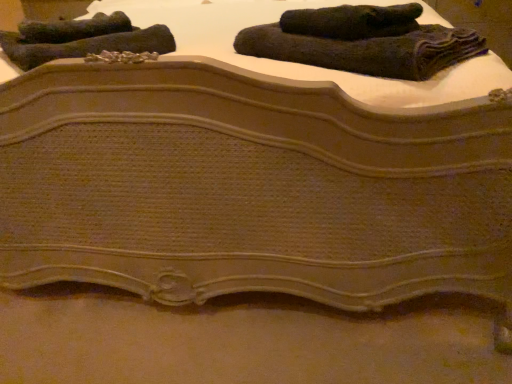
Describe the element at coordinates (352, 21) in the screenshot. This screenshot has height=384, width=512. I see `dark woolen towel at upper right, which appears as the third towel when viewed from the left` at that location.

The height and width of the screenshot is (384, 512). What do you see at coordinates (74, 28) in the screenshot?
I see `dark gray textured towel at upper left, the first towel viewed from the left` at bounding box center [74, 28].

You are a GUI agent. You are given a task and a screenshot of the screen. Output one action in this format:
    pyautogui.click(x=<x>, y=<y>)
    Task: Click on the dark woolen towel at upper center, which appears as the 1th towel when viewed from the right
    The image size is (512, 384).
    Given the screenshot: What is the action you would take?
    pyautogui.click(x=368, y=50)

What do you see at coordinates (86, 46) in the screenshot?
I see `dark green textured towel at upper left, which ranks as the third towel in right-to-left order` at bounding box center [86, 46].

Identify the location of dark woolen towel at upper right, which appears as the third towel when viewed from the left. Image resolution: width=512 pixels, height=384 pixels. (352, 21).

Relative to dark woolen towel at upper right, which appears as the third towel when viewed from the left, is dark gray textured towel at upper left, the first towel viewed from the left, in front or behind?

Visually, dark gray textured towel at upper left, the first towel viewed from the left, is located behind dark woolen towel at upper right, which appears as the third towel when viewed from the left.

Considering the sizes of objects dark gray textured towel at upper left, the first towel viewed from the left, and dark woolen towel at upper right, which is the second towel in right-to-left order, in the image provided, who is wider, dark gray textured towel at upper left, the first towel viewed from the left, or dark woolen towel at upper right, which is the second towel in right-to-left order,?

dark gray textured towel at upper left, the first towel viewed from the left, is wider.

Between point (103, 25) and point (293, 24), which one is positioned behind?

The point (103, 25) is more distant.

From the image's perspective, count 2nd towels downward from the dark gray textured towel at upper left, the first towel viewed from the left, and point to it. Please provide its 2D coordinates.

[(352, 21)]

From the image's perspective, would you say dark woolen towel at upper center, which appears as the 1th towel when viewed from the right, is shown under dark green textured towel at upper left, the second towel viewed from the left?

Yes, from the image's perspective, dark woolen towel at upper center, which appears as the 1th towel when viewed from the right, is below dark green textured towel at upper left, the second towel viewed from the left.

Does dark woolen towel at upper center, which is the 4th towel in left-to-right order, have a smaller size compared to dark green textured towel at upper left, which ranks as the third towel in right-to-left order?

Incorrect, dark woolen towel at upper center, which is the 4th towel in left-to-right order, is not smaller in size than dark green textured towel at upper left, which ranks as the third towel in right-to-left order.

Is dark woolen towel at upper center, which is the 4th towel in left-to-right order, taller than dark green textured towel at upper left, which ranks as the third towel in right-to-left order?

Correct, dark woolen towel at upper center, which is the 4th towel in left-to-right order, is much taller as dark green textured towel at upper left, which ranks as the third towel in right-to-left order.

Between dark woolen towel at upper center, which is the 4th towel in left-to-right order, and dark green textured towel at upper left, which ranks as the third towel in right-to-left order, which one is positioned in front?

dark woolen towel at upper center, which is the 4th towel in left-to-right order, is more forward.

Which of these two, dark gray textured towel at upper left, which is counted as the fourth towel, starting from the right, or dark green textured towel at upper left, which ranks as the third towel in right-to-left order, stands taller?

dark gray textured towel at upper left, which is counted as the fourth towel, starting from the right, is taller.

Which is farther, (115,20) or (22,70)?

Positioned behind is point (115,20).

From the image's perspective, does dark gray textured towel at upper left, the first towel viewed from the left, appear lower than dark green textured towel at upper left, the second towel viewed from the left?

No, from the image's perspective, dark gray textured towel at upper left, the first towel viewed from the left, is not beneath dark green textured towel at upper left, the second towel viewed from the left.

Does dark gray textured towel at upper left, which is counted as the fourth towel, starting from the right, appear on the left side of dark green textured towel at upper left, which ranks as the third towel in right-to-left order?

Yes, dark gray textured towel at upper left, which is counted as the fourth towel, starting from the right, is to the left of dark green textured towel at upper left, which ranks as the third towel in right-to-left order.

Looking at this image, considering the positions of objects dark woolen towel at upper center, which appears as the 1th towel when viewed from the right, and dark woolen towel at upper right, which appears as the third towel when viewed from the left, in the image provided, who is more to the left, dark woolen towel at upper center, which appears as the 1th towel when viewed from the right, or dark woolen towel at upper right, which appears as the third towel when viewed from the left,?

dark woolen towel at upper right, which appears as the third towel when viewed from the left.

Could you tell me if dark woolen towel at upper center, which is the 4th towel in left-to-right order, is turned towards dark woolen towel at upper right, which is the second towel in right-to-left order?

No, dark woolen towel at upper center, which is the 4th towel in left-to-right order, is not facing towards dark woolen towel at upper right, which is the second towel in right-to-left order.

Based on the photo, between dark woolen towel at upper center, which is the 4th towel in left-to-right order, and dark woolen towel at upper right, which is the second towel in right-to-left order, which one has smaller size?

dark woolen towel at upper right, which is the second towel in right-to-left order, is smaller.

Is dark woolen towel at upper right, which is the second towel in right-to-left order, wider or thinner than dark woolen towel at upper center, which appears as the 1th towel when viewed from the right?

In the image, dark woolen towel at upper right, which is the second towel in right-to-left order, appears to be more narrow than dark woolen towel at upper center, which appears as the 1th towel when viewed from the right.

Who is shorter, dark woolen towel at upper right, which is the second towel in right-to-left order, or dark woolen towel at upper center, which is the 4th towel in left-to-right order?

dark woolen towel at upper right, which is the second towel in right-to-left order, is shorter.

Is dark woolen towel at upper right, which appears as the third towel when viewed from the left, smaller than dark woolen towel at upper center, which is the 4th towel in left-to-right order?

Indeed, dark woolen towel at upper right, which appears as the third towel when viewed from the left, has a smaller size compared to dark woolen towel at upper center, which is the 4th towel in left-to-right order.

How many degrees apart are the facing directions of dark woolen towel at upper right, which appears as the third towel when viewed from the left, and dark woolen towel at upper center, which appears as the 1th towel when viewed from the right?

0.00111 degrees.

Looking at this image, from a real-world perspective, between dark green textured towel at upper left, the second towel viewed from the left, and dark gray textured towel at upper left, which is counted as the fourth towel, starting from the right, who is vertically higher?

From a 3D spatial view, dark gray textured towel at upper left, which is counted as the fourth towel, starting from the right, is above.

From the image's perspective, which object appears higher, dark green textured towel at upper left, the second towel viewed from the left, or dark gray textured towel at upper left, the first towel viewed from the left?

dark gray textured towel at upper left, the first towel viewed from the left, appears higher in the image.

Considering the relative sizes of dark green textured towel at upper left, which ranks as the third towel in right-to-left order, and dark gray textured towel at upper left, the first towel viewed from the left, in the image provided, is dark green textured towel at upper left, which ranks as the third towel in right-to-left order, taller than dark gray textured towel at upper left, the first towel viewed from the left,?

Incorrect, the height of dark green textured towel at upper left, which ranks as the third towel in right-to-left order, is not larger of that of dark gray textured towel at upper left, the first towel viewed from the left.

Which is further, (67, 53) or (33, 39)?

The point (33, 39) is behind.

You are a GUI agent. You are given a task and a screenshot of the screen. Output one action in this format:
    pyautogui.click(x=<x>, y=<y>)
    Task: Click on the 3rd towel directly beneath the dark woolen towel at upper right, which appears as the third towel when viewed from the left (from a real-world perspective)
    
    Given the screenshot: What is the action you would take?
    pyautogui.click(x=86, y=46)

Measure the distance from dark green textured towel at upper left, which ranks as the third towel in right-to-left order, to dark woolen towel at upper right, which appears as the third towel when viewed from the left.

dark green textured towel at upper left, which ranks as the third towel in right-to-left order, is 18.64 inches away from dark woolen towel at upper right, which appears as the third towel when viewed from the left.

Which point is more forward, (126,34) or (290,30)?

The point (290,30) is in front.

Find the location of `the 2nd towel behind the dark woolen towel at upper right, which is the second towel in right-to-left order`. the 2nd towel behind the dark woolen towel at upper right, which is the second towel in right-to-left order is located at coordinates (74, 28).

Locate an element on the screen. The height and width of the screenshot is (384, 512). towel beneath the dark woolen towel at upper center, which appears as the 1th towel when viewed from the right (from a real-world perspective) is located at coordinates (86, 46).

Based on their spatial positions, is dark woolen towel at upper center, which appears as the 1th towel when viewed from the right, or dark gray textured towel at upper left, the first towel viewed from the left, closer to dark green textured towel at upper left, which ranks as the third towel in right-to-left order?

dark gray textured towel at upper left, the first towel viewed from the left, lies closer to dark green textured towel at upper left, which ranks as the third towel in right-to-left order, than the other object.

From the image, which object appears to be farther from dark woolen towel at upper right, which appears as the third towel when viewed from the left, dark woolen towel at upper center, which is the 4th towel in left-to-right order, or dark green textured towel at upper left, which ranks as the third towel in right-to-left order?

Among the two, dark green textured towel at upper left, which ranks as the third towel in right-to-left order, is located further to dark woolen towel at upper right, which appears as the third towel when viewed from the left.

Looking at the image, which one is located further to dark woolen towel at upper right, which is the second towel in right-to-left order, dark gray textured towel at upper left, the first towel viewed from the left, or dark green textured towel at upper left, which ranks as the third towel in right-to-left order?

Among the two, dark gray textured towel at upper left, the first towel viewed from the left, is located further to dark woolen towel at upper right, which is the second towel in right-to-left order.

Based on their spatial positions, is dark woolen towel at upper right, which is the second towel in right-to-left order, or dark green textured towel at upper left, the second towel viewed from the left, closer to dark gray textured towel at upper left, which is counted as the fourth towel, starting from the right?

dark green textured towel at upper left, the second towel viewed from the left, is positioned closer to the anchor dark gray textured towel at upper left, which is counted as the fourth towel, starting from the right.

Which object lies nearer to the anchor point dark woolen towel at upper center, which is the 4th towel in left-to-right order, dark gray textured towel at upper left, which is counted as the fourth towel, starting from the right, or dark green textured towel at upper left, which ranks as the third towel in right-to-left order?

dark green textured towel at upper left, which ranks as the third towel in right-to-left order, lies closer to dark woolen towel at upper center, which is the 4th towel in left-to-right order, than the other object.

From the image, which object appears to be nearer to dark gray textured towel at upper left, the first towel viewed from the left, dark woolen towel at upper right, which appears as the third towel when viewed from the left, or dark woolen towel at upper center, which is the 4th towel in left-to-right order?

Among the two, dark woolen towel at upper center, which is the 4th towel in left-to-right order, is located nearer to dark gray textured towel at upper left, the first towel viewed from the left.

From the image, which object appears to be farther from dark woolen towel at upper center, which appears as the 1th towel when viewed from the right, dark green textured towel at upper left, the second towel viewed from the left, or dark woolen towel at upper right, which appears as the third towel when viewed from the left?

dark green textured towel at upper left, the second towel viewed from the left, lies further to dark woolen towel at upper center, which appears as the 1th towel when viewed from the right, than the other object.

From the image, which object appears to be nearer to dark green textured towel at upper left, the second towel viewed from the left, dark woolen towel at upper right, which is the second towel in right-to-left order, or dark gray textured towel at upper left, which is counted as the fourth towel, starting from the right?

dark gray textured towel at upper left, which is counted as the fourth towel, starting from the right, lies closer to dark green textured towel at upper left, the second towel viewed from the left, than the other object.

Where is `towel located between dark green textured towel at upper left, which ranks as the third towel in right-to-left order, and dark woolen towel at upper center, which appears as the 1th towel when viewed from the right, in the left-right direction`? The width and height of the screenshot is (512, 384). towel located between dark green textured towel at upper left, which ranks as the third towel in right-to-left order, and dark woolen towel at upper center, which appears as the 1th towel when viewed from the right, in the left-right direction is located at coordinates pos(352,21).

Locate an element on the screen. This screenshot has width=512, height=384. towel located between dark gray textured towel at upper left, which is counted as the fourth towel, starting from the right, and dark woolen towel at upper right, which appears as the third towel when viewed from the left, in the left-right direction is located at coordinates (86, 46).